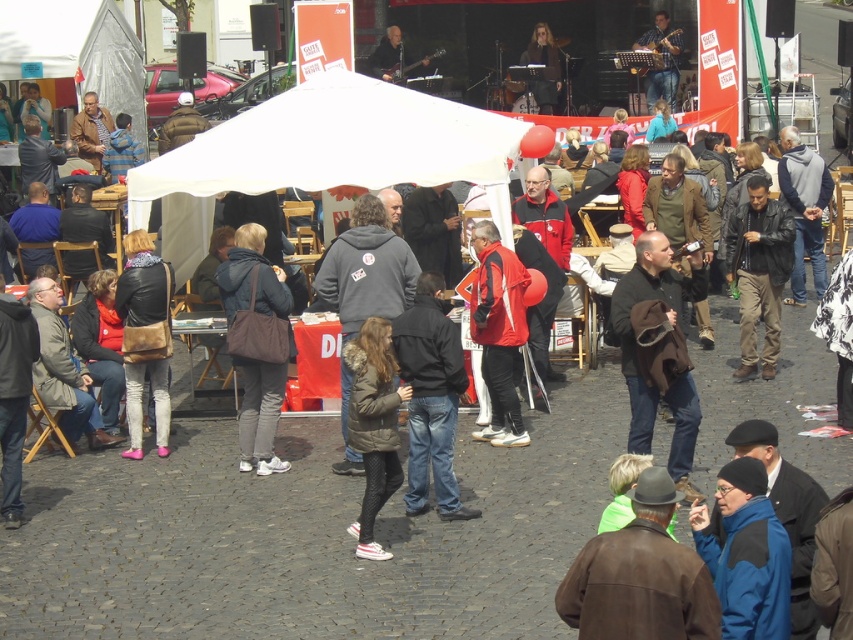
Looking at this image, is the position of dark green textured coat at center less distant than that of leather jacket at right?

Yes, dark green textured coat at center is in front of leather jacket at right.

Which of these two, dark green textured coat at center or leather jacket at right, stands shorter?

Standing shorter between the two is dark green textured coat at center.

Identify the location of dark green textured coat at center. This screenshot has height=640, width=853. pyautogui.click(x=373, y=426).

The image size is (853, 640). What are the coordinates of `dark green textured coat at center` in the screenshot? It's located at (373, 426).

Which of these two, dark brown leather jacket at center or leather jacket at right, stands shorter?

With less height is dark brown leather jacket at center.

Is dark brown leather jacket at center smaller than leather jacket at right?

Correct, dark brown leather jacket at center occupies less space than leather jacket at right.

Does point (648, 397) come farther from viewer compared to point (778, 205)?

No.

Where is `dark brown leather jacket at center`? This screenshot has height=640, width=853. dark brown leather jacket at center is located at coordinates (639, 348).

Does point (262, 467) come behind point (640, 298)?

Yes, it is behind point (640, 298).

Does point (244, 250) come in front of point (640, 372)?

No, (244, 250) is further to viewer.

At what (x,y) coordinates should I click in order to perform the action: click on matte brown bag at center. Please return your answer as a coordinate pair (x, y). The width and height of the screenshot is (853, 640). Looking at the image, I should click on (257, 342).